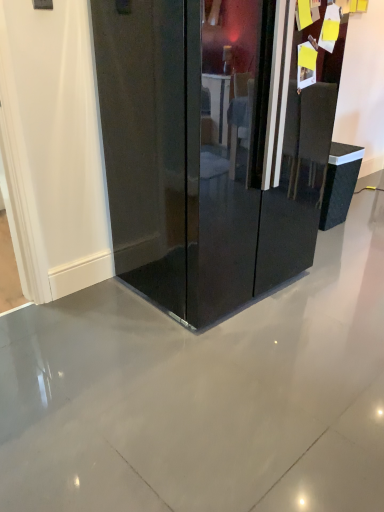
Question: Is glossy black refrigerator at center positioned with its back to black glossy trash can at right?

Choices:
 (A) no
 (B) yes

Answer: (A)

Question: From the image's perspective, is glossy black refrigerator at center located beneath black glossy trash can at right?

Choices:
 (A) no
 (B) yes

Answer: (A)

Question: From a real-world perspective, does glossy black refrigerator at center stand above black glossy trash can at right?

Choices:
 (A) yes
 (B) no

Answer: (A)

Question: Considering the relative sizes of glossy black refrigerator at center and black glossy trash can at right in the image provided, is glossy black refrigerator at center bigger than black glossy trash can at right?

Choices:
 (A) yes
 (B) no

Answer: (A)

Question: Is there a large distance between glossy black refrigerator at center and black glossy trash can at right?

Choices:
 (A) no
 (B) yes

Answer: (B)

Question: Does glossy black refrigerator at center have a lesser width compared to black glossy trash can at right?

Choices:
 (A) yes
 (B) no

Answer: (B)

Question: Is the position of black glossy trash can at right less distant than that of glossy black refrigerator at center?

Choices:
 (A) no
 (B) yes

Answer: (A)

Question: Would you consider black glossy trash can at right to be distant from glossy black refrigerator at center?

Choices:
 (A) no
 (B) yes

Answer: (B)

Question: Can you confirm if black glossy trash can at right is thinner than glossy black refrigerator at center?

Choices:
 (A) no
 (B) yes

Answer: (B)

Question: Considering the relative sizes of black glossy trash can at right and glossy black refrigerator at center in the image provided, is black glossy trash can at right taller than glossy black refrigerator at center?

Choices:
 (A) yes
 (B) no

Answer: (B)

Question: Does black glossy trash can at right have a lesser height compared to glossy black refrigerator at center?

Choices:
 (A) no
 (B) yes

Answer: (B)

Question: Is the position of black glossy trash can at right more distant than that of glossy black refrigerator at center?

Choices:
 (A) yes
 (B) no

Answer: (A)

Question: Would you say glossy black refrigerator at center is inside or outside black glossy trash can at right?

Choices:
 (A) inside
 (B) outside

Answer: (B)